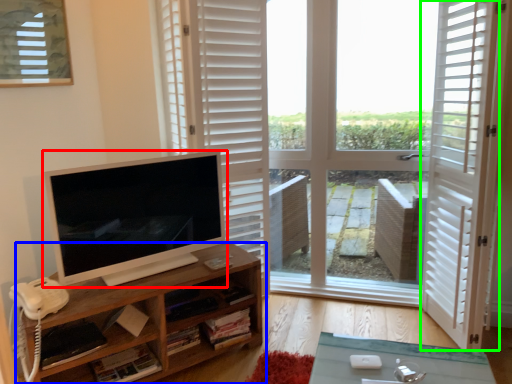
Question: Which object is the closest to the computer monitor (highlighted by a red box)? Choose among these: shelf (highlighted by a blue box) or screen door (highlighted by a green box).

Choices:
 (A) shelf
 (B) screen door

Answer: (A)